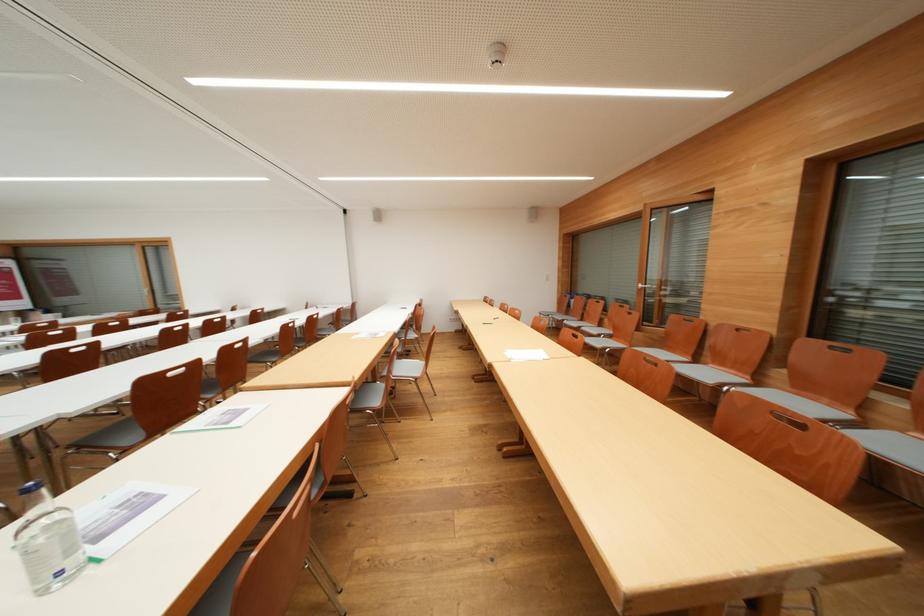
Find where to turn the silver door handle. Please return your answer as a coordinate pair (x, y).

(647, 286)